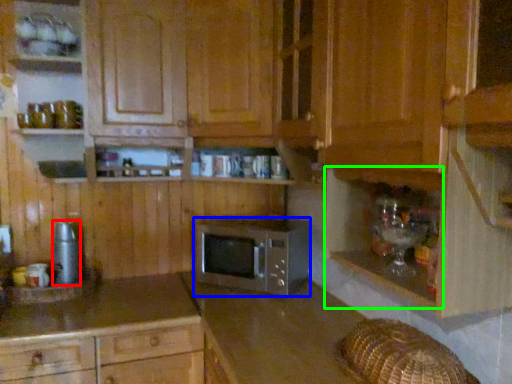
Question: Which object is positioned closest to appliance (highlighted by a red box)? Select from microwave oven (highlighted by a blue box) and shelf (highlighted by a green box).

Choices:
 (A) microwave oven
 (B) shelf

Answer: (A)